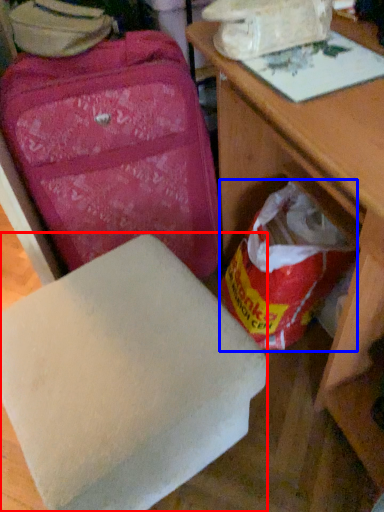
Question: Which of the following is the closest to the observer, furniture (highlighted by a red box) or grocery bag (highlighted by a blue box)?

Choices:
 (A) furniture
 (B) grocery bag

Answer: (A)